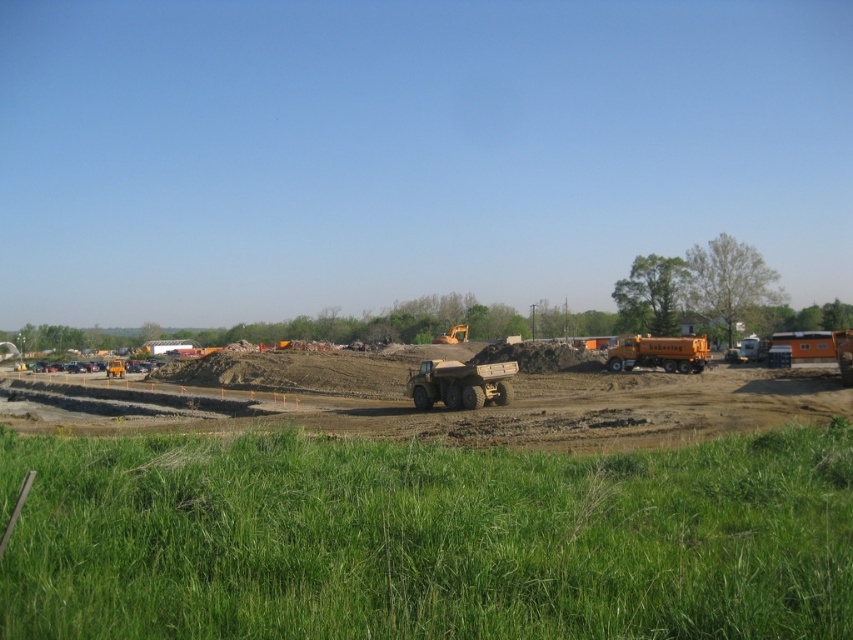
Who is more distant from viewer, [450,548] or [730,400]?

Positioned behind is point [730,400].

Can you confirm if green grass at lower center is positioned to the left of matte yellow truck at center?

No, green grass at lower center is not to the left of matte yellow truck at center.

The width and height of the screenshot is (853, 640). What do you see at coordinates (426, 538) in the screenshot? I see `green grass at lower center` at bounding box center [426, 538].

Locate an element on the screen. This screenshot has height=640, width=853. green grass at lower center is located at coordinates (426, 538).